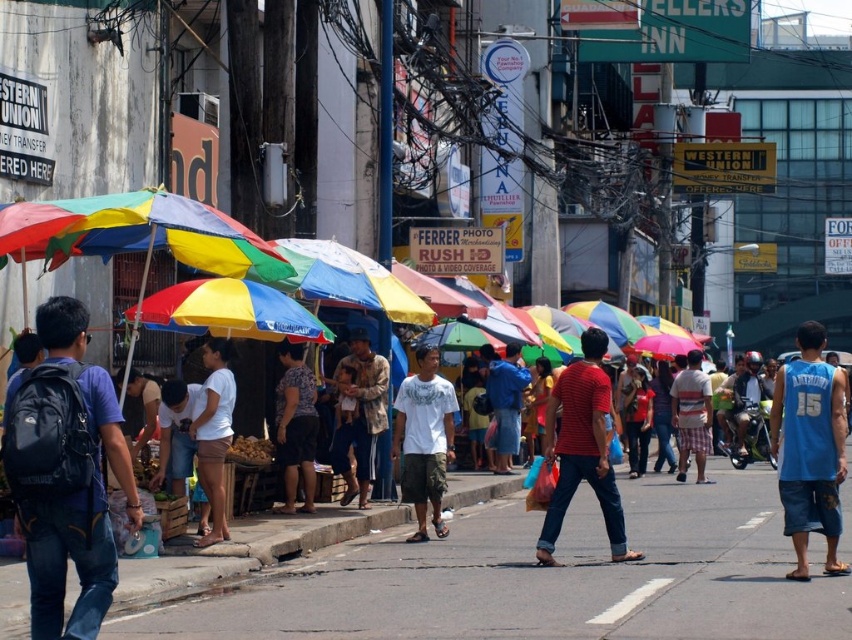
Question: Which is farther from the red striped shirt at center?

Choices:
 (A) white matte shorts at center
 (B) striped t-shirt at center
 (C) blue jersey at right

Answer: (B)

Question: Observing the image, what is the correct spatial positioning of white cotton shirt at center in reference to white matte shorts at center?

Choices:
 (A) left
 (B) right

Answer: (B)

Question: Can you confirm if red striped shirt at center is thinner than printed cotton shirt at center?

Choices:
 (A) yes
 (B) no

Answer: (B)

Question: In this image, where is blue jersey at right located relative to striped t-shirt at center?

Choices:
 (A) below
 (B) above

Answer: (A)

Question: Which object appears farthest from the camera in this image?

Choices:
 (A) striped t-shirt at center
 (B) printed cotton shirt at center
 (C) white matte shorts at center
 (D) red striped shirt at center

Answer: (A)

Question: Estimate the real-world distances between objects in this image. Which object is closer to the white matte shorts at center?

Choices:
 (A) striped t-shirt at center
 (B) printed cotton shirt at center
 (C) gray asphalt at center
 (D) red striped shirt at center

Answer: (B)